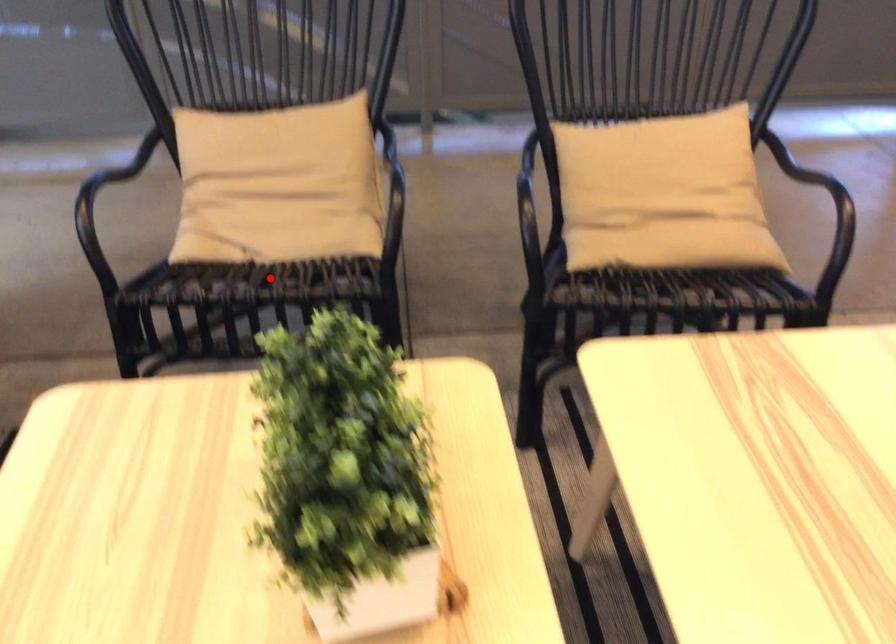
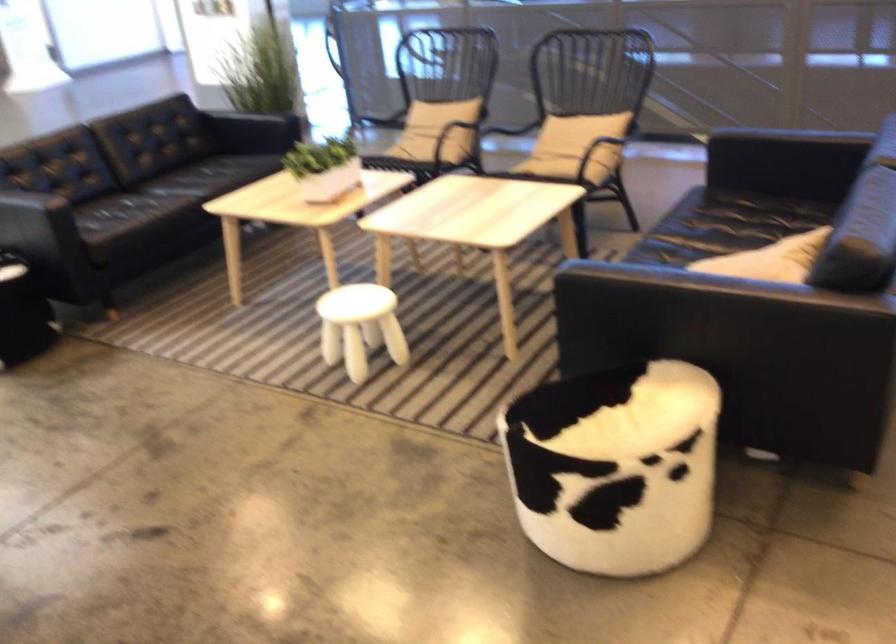
Question: A red point is marked in image1. In image2, is the corresponding 3D point closer to the camera or farther? Reply with the corresponding letter.

Choices:
 (A) The corresponding 3D point is closer.
 (B) The corresponding 3D point is farther.

Answer: (B)